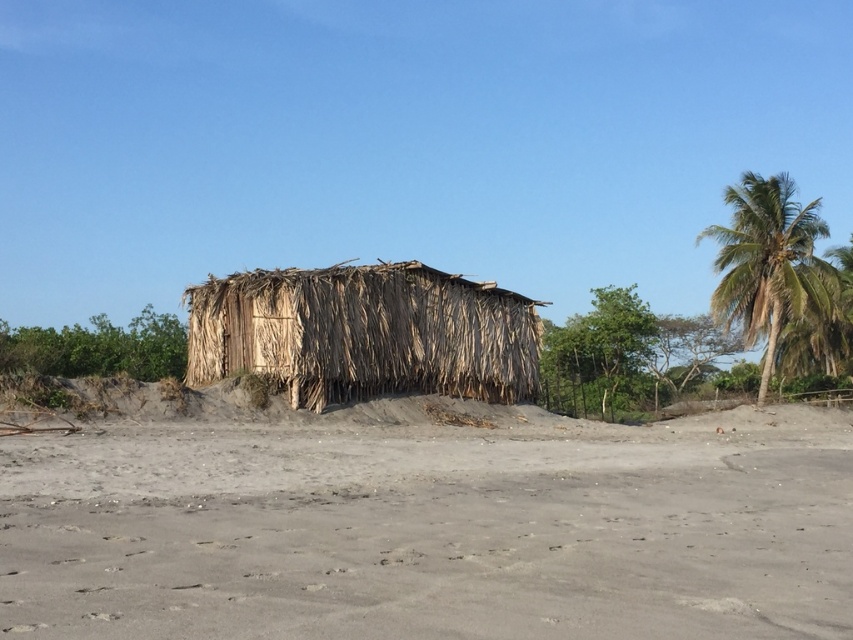
You are standing at the entrance of the rustic hut and want to walk towards the green leafy palm tree at upper right. Which direction should you head to, considering the gray sandy beach at center is between you and the palm tree?

Since the gray sandy beach at center is shorter than the green leafy palm tree at upper right, you should walk towards the right side of the gray sandy beach at center to reach the palm tree.

You are standing at the entrance of the rustic hut and want to walk towards the gray sandy beach at center. In which direction should you head from the hut?

The gray sandy beach at center is located at point (433, 531), so you should head towards the center of the image from the rustic hut.

You are standing on the beach and want to take a photo of the dry grass hut at center and the green leafy palm tree at upper right. Which object will appear larger in the photo?

The dry grass hut at center will appear larger in the photo because it is closer to the viewer than the green leafy palm tree at upper right.